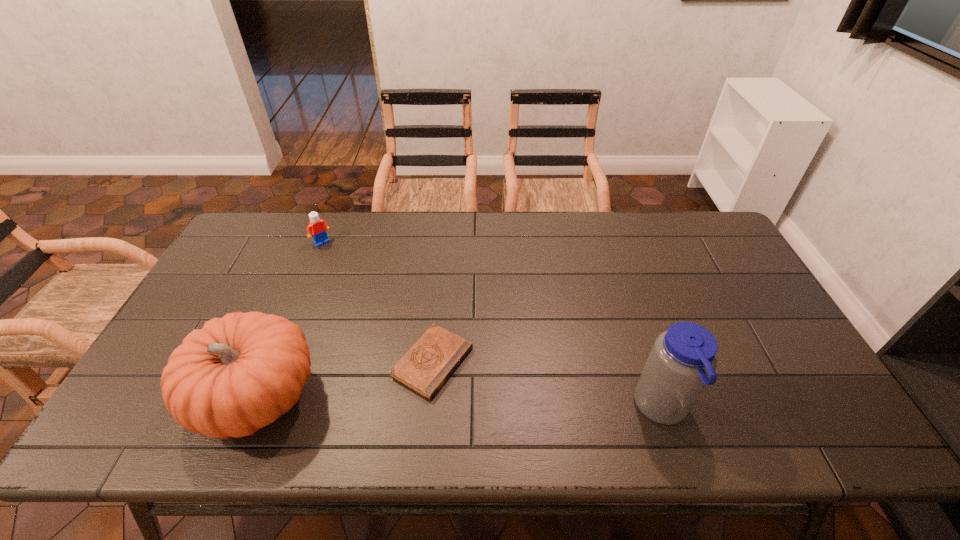
The height and width of the screenshot is (540, 960). Find the location of `free space on the desktop that is between the second tallest object and the tallest object and is positioned on the spine side of the shortest object`. free space on the desktop that is between the second tallest object and the tallest object and is positioned on the spine side of the shortest object is located at coordinates (509, 404).

Locate an element on the screen. vacant space on the desktop that is between the second tallest object and the tallest object and is positioned on the face of the farthest object is located at coordinates (476, 403).